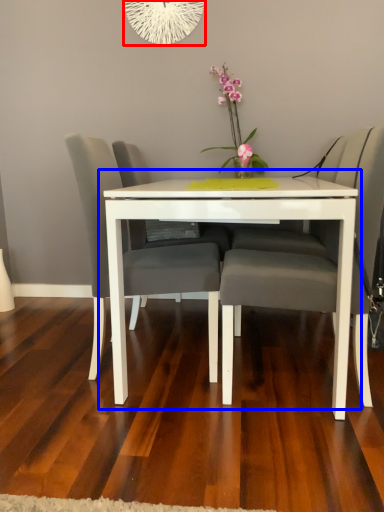
Question: Among these objects, which one is farthest to the camera, oval (highlighted by a red box) or table (highlighted by a blue box)?

Choices:
 (A) oval
 (B) table

Answer: (A)